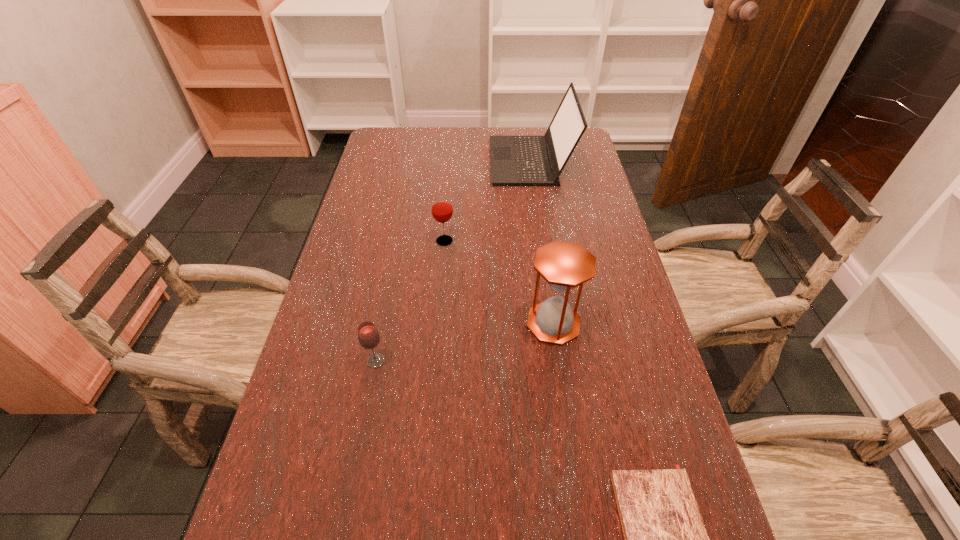
Find the location of a particular element. The height and width of the screenshot is (540, 960). free space at the far left corner is located at coordinates (406, 139).

This screenshot has width=960, height=540. In the image, there is a desktop. Find the location of `vacant region at the far right corner`. vacant region at the far right corner is located at coordinates (585, 140).

Where is `free spot between the hourglass and the farthest object`? free spot between the hourglass and the farthest object is located at coordinates (542, 242).

You are a GUI agent. You are given a task and a screenshot of the screen. Output one action in this format:
    pyautogui.click(x=<x>, y=<y>)
    Task: Click on the vacant space that is in between the left glass drink container and the farther glass drink container
    This screenshot has height=540, width=960.
    Given the screenshot: What is the action you would take?
    pyautogui.click(x=410, y=301)

Identify the location of vacant space that's between the second shortest object and the laptop. (453, 261).

This screenshot has height=540, width=960. What are the coordinates of `vacant area between the shorter glass drink container and the taller glass drink container` in the screenshot? It's located at (410, 301).

Find the location of `vacant region between the nearer glass drink container and the hourglass`. vacant region between the nearer glass drink container and the hourglass is located at coordinates (465, 342).

At what (x,y) coordinates should I click in order to perform the action: click on empty space between the hourglass and the third shortest object. Please return your answer as a coordinate pair (x, y). The width and height of the screenshot is (960, 540). Looking at the image, I should click on (499, 282).

This screenshot has height=540, width=960. Find the location of `free spot between the farthest object and the second object from left to right`. free spot between the farthest object and the second object from left to right is located at coordinates (488, 201).

Identify the location of free point between the laptop and the taller glass drink container. The height and width of the screenshot is (540, 960). (488, 201).